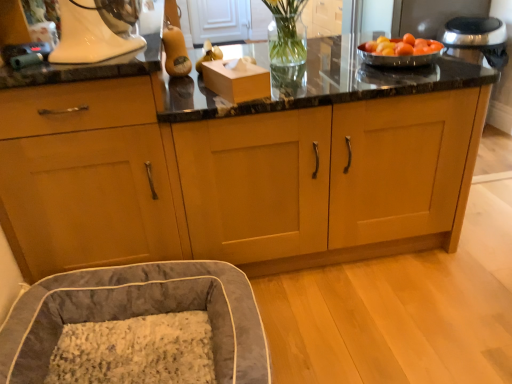
Question: Is matte wood cabinets at center, the 1th cabinetry in the right-to-left sequence, positioned beyond the bounds of white glossy stand mixer at upper left?

Choices:
 (A) no
 (B) yes

Answer: (B)

Question: Does matte wood cabinets at center, the 2th cabinetry when ordered from left to right, appear on the right side of white glossy stand mixer at upper left?

Choices:
 (A) yes
 (B) no

Answer: (A)

Question: Is white glossy stand mixer at upper left at the back of matte wood cabinets at center, the 1th cabinetry in the right-to-left sequence?

Choices:
 (A) no
 (B) yes

Answer: (A)

Question: Does matte wood cabinets at center, the 2th cabinetry when ordered from left to right, have a larger size compared to white glossy stand mixer at upper left?

Choices:
 (A) yes
 (B) no

Answer: (A)

Question: From a real-world perspective, does matte wood cabinets at center, the 1th cabinetry in the right-to-left sequence, stand above white glossy stand mixer at upper left?

Choices:
 (A) no
 (B) yes

Answer: (A)

Question: Is matte wood cabinets at center, the 1th cabinetry in the right-to-left sequence, thinner than white glossy stand mixer at upper left?

Choices:
 (A) no
 (B) yes

Answer: (A)

Question: Is white glossy stand mixer at upper left positioned with its back to velvet gray bean bag at lower left?

Choices:
 (A) no
 (B) yes

Answer: (A)

Question: Considering the relative positions of white glossy stand mixer at upper left and velvet gray bean bag at lower left in the image provided, is white glossy stand mixer at upper left in front of velvet gray bean bag at lower left?

Choices:
 (A) no
 (B) yes

Answer: (A)

Question: Is white glossy stand mixer at upper left taller than velvet gray bean bag at lower left?

Choices:
 (A) yes
 (B) no

Answer: (B)

Question: Can you confirm if white glossy stand mixer at upper left is wider than velvet gray bean bag at lower left?

Choices:
 (A) yes
 (B) no

Answer: (B)

Question: From the image's perspective, is white glossy stand mixer at upper left located beneath velvet gray bean bag at lower left?

Choices:
 (A) no
 (B) yes

Answer: (A)

Question: Is white glossy stand mixer at upper left bigger than velvet gray bean bag at lower left?

Choices:
 (A) yes
 (B) no

Answer: (B)

Question: Can you confirm if velvet gray bean bag at lower left is shorter than white glossy stand mixer at upper left?

Choices:
 (A) yes
 (B) no

Answer: (B)